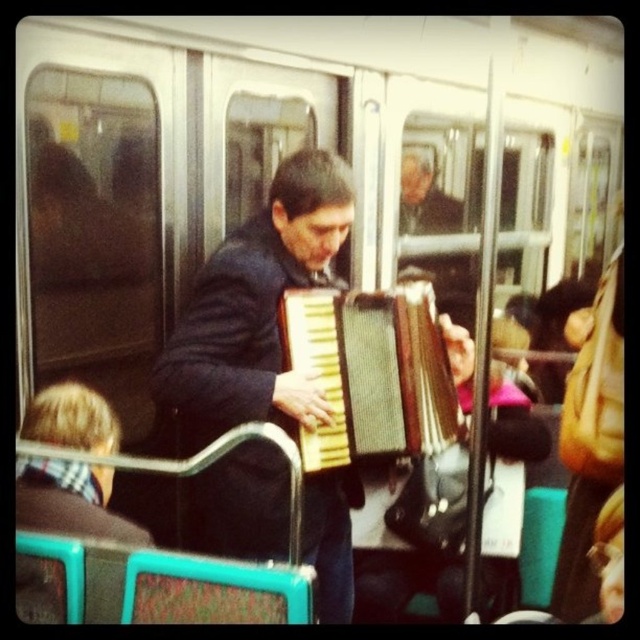
You are a passenger on the subway and see both the dark blue fabric accordion at center and the wooden accordion at center. Which one is positioned lower in the image?

The dark blue fabric accordion at center is positioned lower than the wooden accordion at center.

You are a subway passenger holding a 10 inch wide instrument case. You see the dark blue fabric accordion at center and the wooden accordion at center. Can you place your instrument case between them without overlapping?

The dark blue fabric accordion at center is 8.53 inches from wooden accordion at center. Since your instrument case is 10 inches wide, it cannot fit between them as the distance is smaller than the case.

You are a photographer positioned at the front of the subway car. You want to take a closeup shot of the dark blue fabric accordion at center. Considering the distance between you and the accordion, can you move closer to get a better shot without exceeding the subway car length?

The dark blue fabric accordion at center is 1.67 meters away from the camera. Since the photographer is at the front of the subway car, moving closer would require space within the car. Assuming the subway car length allows, reducing the distance would improve the closeup. However, the question doesn not provide subway car length, so focus on the given distance. To get closer than 1.67m, yes, but must ensure not exceeding car limits. However, without car length data, answer based on current distance. Since